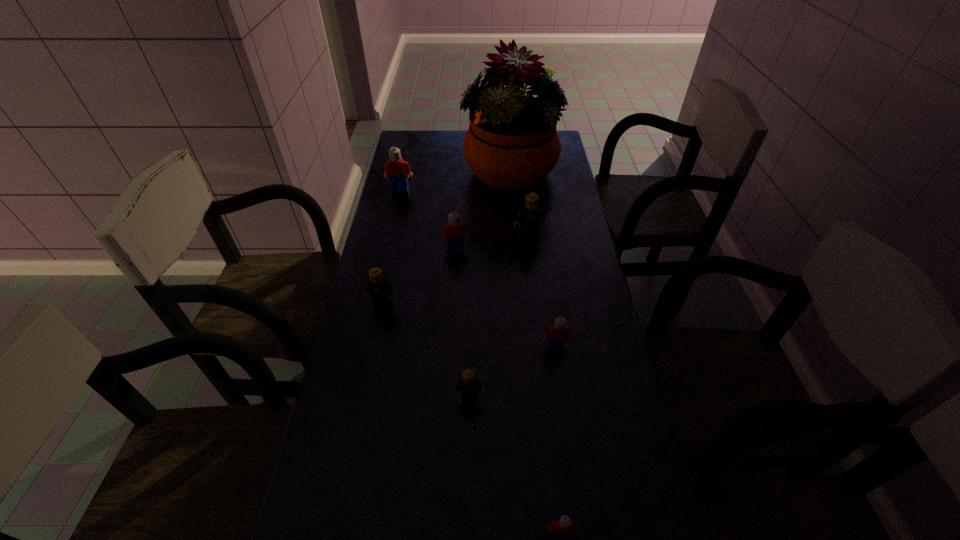
At what (x,y) coordinates should I click in order to perform the action: click on vacant space located 0.270m on the face of the third farthest white Lego. Please return your answer as a coordinate pair (x, y). The height and width of the screenshot is (540, 960). Looking at the image, I should click on (570, 448).

Where is `vacant region located 0.060m in front of the second nearest Lego`? Image resolution: width=960 pixels, height=540 pixels. vacant region located 0.060m in front of the second nearest Lego is located at coordinates (468, 427).

Find the location of a particular element. object at the far edge is located at coordinates (512, 144).

The width and height of the screenshot is (960, 540). I want to click on flower arrangement situated at the right edge, so click(512, 144).

Find the location of `object located at the far right corner`. object located at the far right corner is located at coordinates (512, 144).

At what (x,y) coordinates should I click in order to perform the action: click on free space at the far edge of the desktop. Please return your answer as a coordinate pair (x, y). Looking at the image, I should click on (441, 143).

The image size is (960, 540). Find the location of `free space at the left edge of the desktop`. free space at the left edge of the desktop is located at coordinates (345, 475).

Locate an element on the screen. vacant space at the right edge of the desktop is located at coordinates (553, 206).

Identify the location of vacant area that lies between the second nearest object and the sixth farthest object. Image resolution: width=960 pixels, height=540 pixels. (513, 373).

Where is `free space between the fourth nearest Lego and the second farthest white Lego`? Image resolution: width=960 pixels, height=540 pixels. free space between the fourth nearest Lego and the second farthest white Lego is located at coordinates (420, 276).